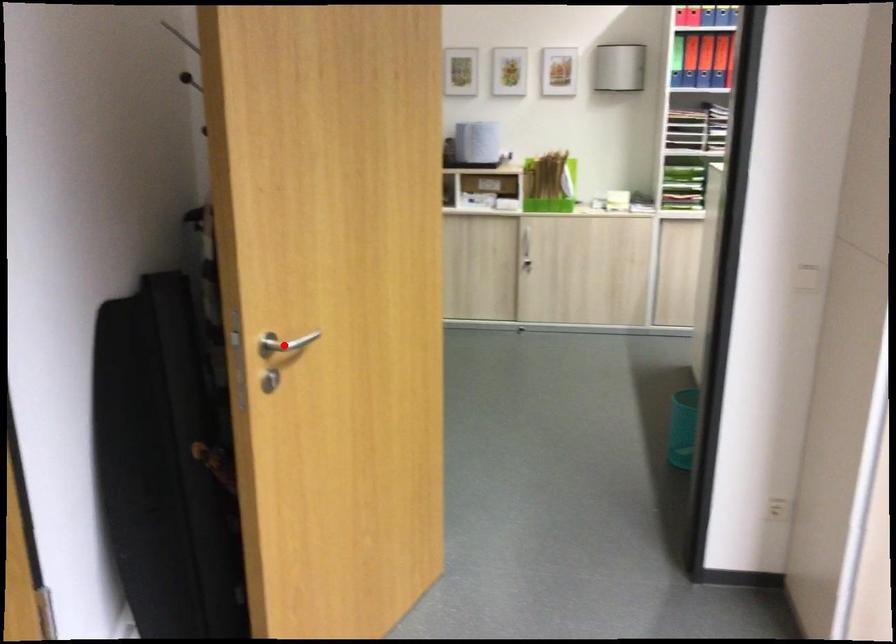
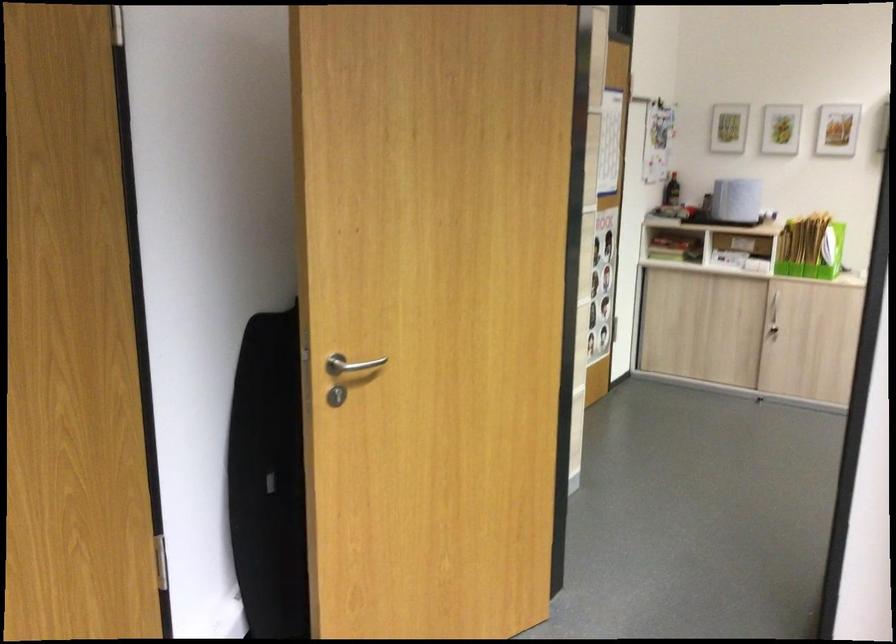
Find the pixel in the second image that matches the highlighted location in the first image.

(350, 365)